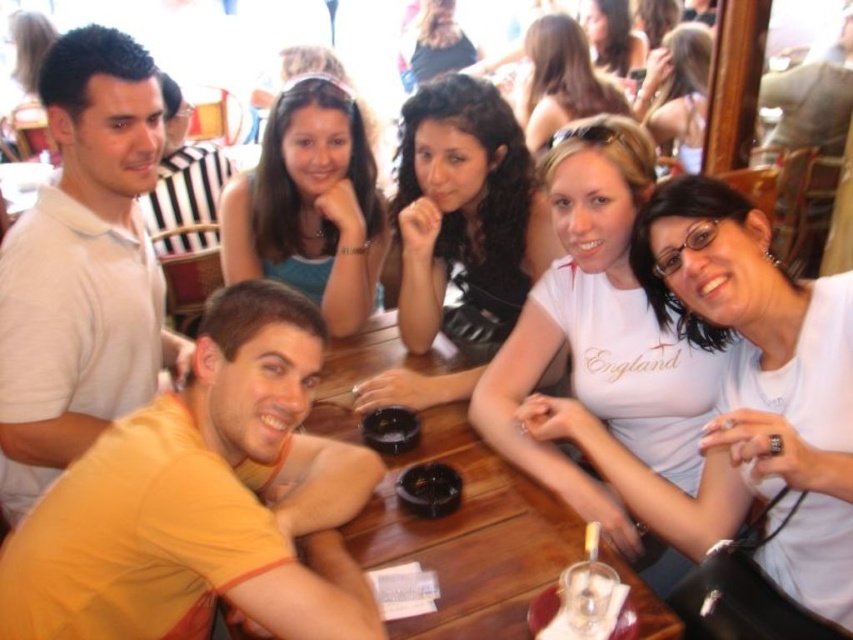
You are a photographer standing at the back of the room. You want to take a photo of the white cotton shirt at center and dark brown hair at upper center without anyone else in the frame. Can you move closer to the table to achieve this?

The white cotton shirt at center is 3.20 meters away from dark brown hair at upper center. Moving closer to the table may allow you to frame the shot so that only these two subjects are visible, as the distance between them is sufficient to avoid including others when adjusting your position.

From the picture: You are a photographer trying to capture a group photo of the people at the table. You notice the white cotton shirt at center and the dark brown hair at upper center. Which of these two features should you focus on if you want to ensure the subject is clearly visible in the photo?

The white cotton shirt at center should be focused on because it is larger in size than the dark brown hair at upper center, making it more prominent and easier to see in the photo.

You are a photographer standing behind the group of people at the table. You want to take a photo that includes both the white cotton shirt at center and the dark brown hair at upper center. Which object should you adjust your focus to ensure both are in the frame?

The white cotton shirt at center is closer to the viewer than the dark brown hair at upper center, so you should focus on the white cotton shirt at center to ensure both are in the frame.